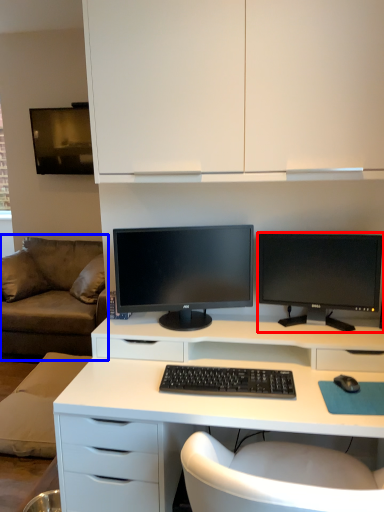
Question: Among these objects, which one is farthest to the camera, computer monitor (highlighted by a red box) or studio couch (highlighted by a blue box)?

Choices:
 (A) computer monitor
 (B) studio couch

Answer: (B)